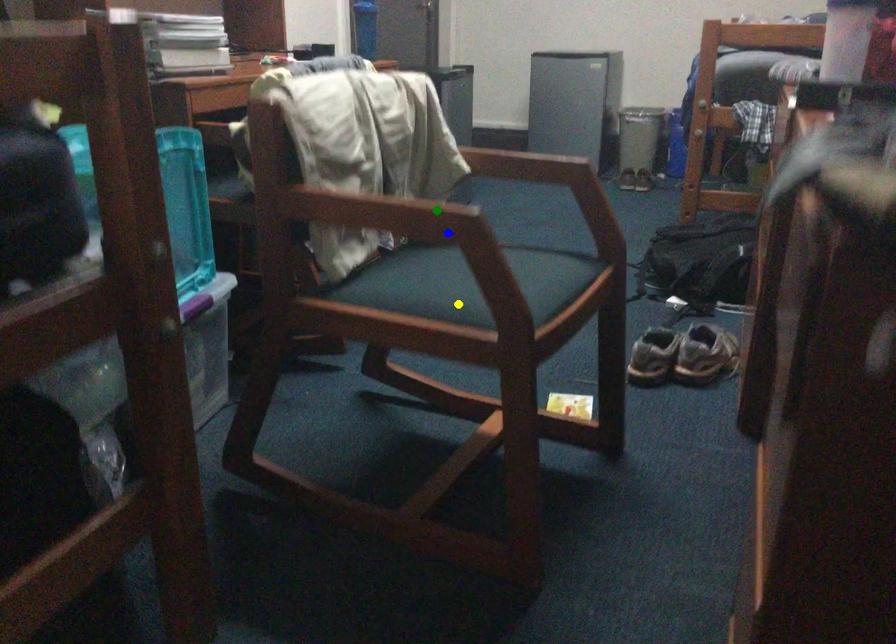
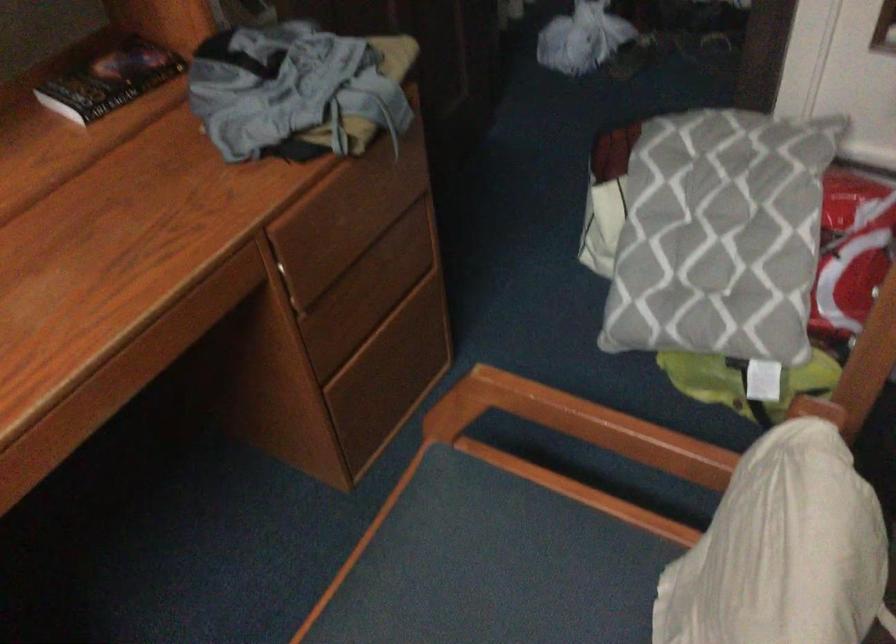
I am providing you with two images of the same scene from different viewpoints. Three points are marked in image1. Which point corresponds to a part or object that is occluded in image2?In image1, three points are marked. Which of them correspond to a part or object that is occluded in image2?Among the three points shown in image1, which one corresponds to a part or object that is no longer visible due to occlusion in image2?

green point cannot be seen in image2.